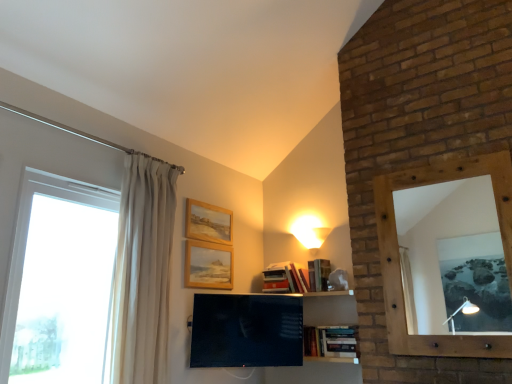
Question: From the image's perspective, is wooden picture frame at upper center, which appears as the second picture frame when viewed from the top, beneath matte black tv at center?

Choices:
 (A) yes
 (B) no

Answer: (B)

Question: Considering the relative sizes of wooden picture frame at upper center, the 1th picture frame positioned from the bottom, and matte black tv at center in the image provided, is wooden picture frame at upper center, the 1th picture frame positioned from the bottom, bigger than matte black tv at center?

Choices:
 (A) no
 (B) yes

Answer: (A)

Question: Is wooden picture frame at upper center, which appears as the second picture frame when viewed from the top, further to the viewer compared to matte black tv at center?

Choices:
 (A) no
 (B) yes

Answer: (B)

Question: Is matte black tv at center surrounded by wooden picture frame at upper center, which appears as the second picture frame when viewed from the top?

Choices:
 (A) no
 (B) yes

Answer: (A)

Question: From the image's perspective, does wooden picture frame at upper center, the 1th picture frame positioned from the bottom, appear higher than matte black tv at center?

Choices:
 (A) yes
 (B) no

Answer: (A)

Question: Considering the positions of wooden-framed mirror at right and white sheer curtain at left in the image, is wooden-framed mirror at right wider or thinner than white sheer curtain at left?

Choices:
 (A) wide
 (B) thin

Answer: (B)

Question: In the image, is wooden-framed mirror at right positioned in front of or behind white sheer curtain at left?

Choices:
 (A) front
 (B) behind

Answer: (B)

Question: From a real-world perspective, is wooden-framed mirror at right physically located above or below white sheer curtain at left?

Choices:
 (A) below
 (B) above

Answer: (B)

Question: Is wooden-framed mirror at right situated inside white sheer curtain at left or outside?

Choices:
 (A) outside
 (B) inside

Answer: (A)

Question: Considering the positions of white glass window at left and matte white lampshade at upper center in the image, is white glass window at left wider or thinner than matte white lampshade at upper center?

Choices:
 (A) wide
 (B) thin

Answer: (B)

Question: In the image, is white glass window at left positioned in front of or behind matte white lampshade at upper center?

Choices:
 (A) behind
 (B) front

Answer: (B)

Question: Is point (32, 206) positioned closer to the camera than point (310, 243)?

Choices:
 (A) farther
 (B) closer

Answer: (B)

Question: Considering the relative positions of white glass window at left and matte white lampshade at upper center in the image provided, is white glass window at left to the left or to the right of matte white lampshade at upper center?

Choices:
 (A) right
 (B) left

Answer: (B)

Question: Considering the relative positions of white glass window at left and matte black tv at center in the image provided, is white glass window at left to the left or to the right of matte black tv at center?

Choices:
 (A) right
 (B) left

Answer: (B)

Question: Considering the positions of white glass window at left and matte black tv at center in the image, is white glass window at left wider or thinner than matte black tv at center?

Choices:
 (A) wide
 (B) thin

Answer: (A)